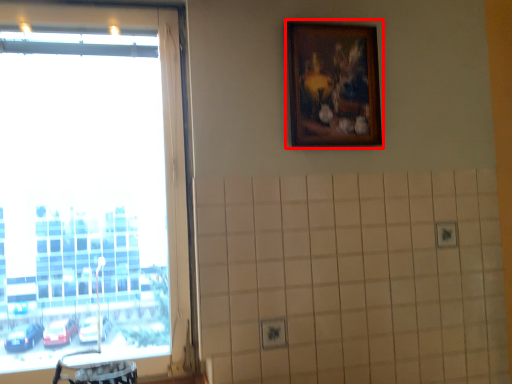
Question: From the image's perspective, what is the correct spatial relationship of picture frame (annotated by the red box) in relation to window?

Choices:
 (A) below
 (B) above

Answer: (B)